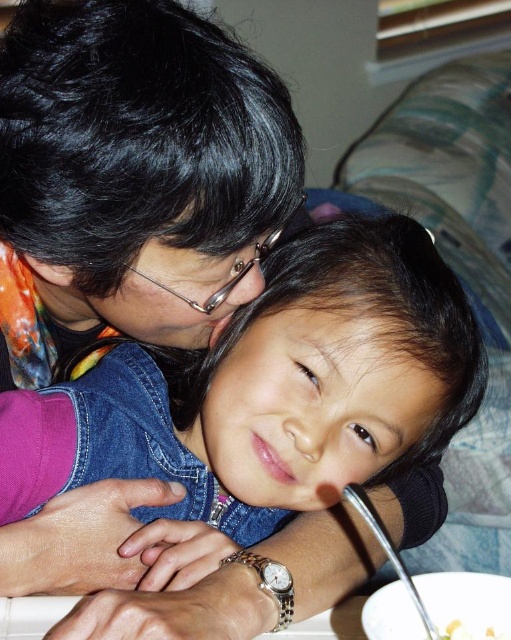
You are a photographer trying to capture a closeup of the metallic frame glasses at upper center and the yellow matte food at lower right. Since you can only focus on one object at a time, which object should you choose to ensure it appears larger in the photo?

You should focus on the metallic frame glasses at upper center because it is bigger than the yellow matte food at lower right, so it will appear larger in the photo.

You are a photographer setting up a shot of the scene. The denim at center and the yellow matte food at lower right are both important elements. To ensure both are in focus, where should you position the camera relative to the table?

The denim at center is above the yellow matte food at lower right, so positioning the camera at eye level with the table would keep both elements in focus as they are vertically aligned.

You are a photographer trying to capture a closeup of the denim at center. Based on the coordinates provided, where should you focus your camera lens?

The denim at center is located at coordinates point (267, 397), so you should focus your camera lens at that exact point to capture the closeup.